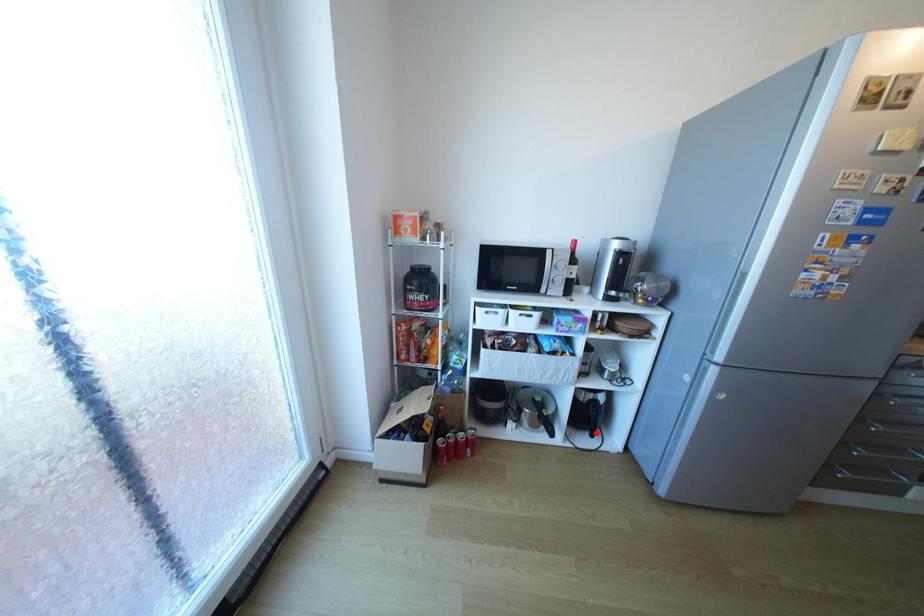
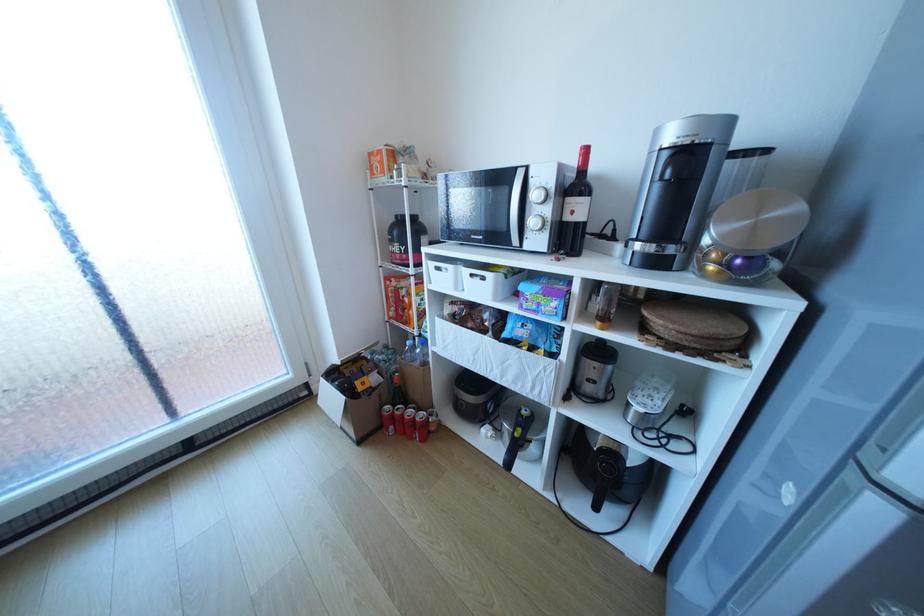
Question: A red point is marked in image1. In image2, is the corresponding 3D point closer to the camera or farther? Reply with the corresponding letter.

Choices:
 (A) The corresponding 3D point is closer.
 (B) The corresponding 3D point is farther.

Answer: (A)